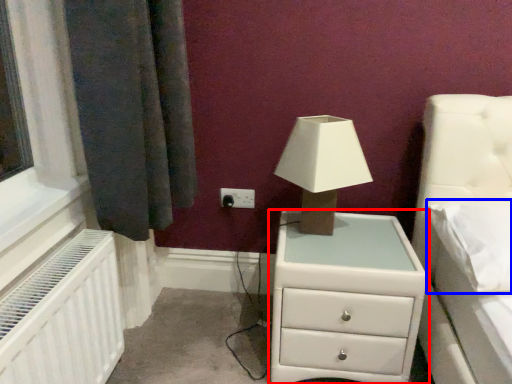
Question: Which object is closer to the camera taking this photo, chest of drawers (highlighted by a red box) or pillow (highlighted by a blue box)?

Choices:
 (A) chest of drawers
 (B) pillow

Answer: (B)